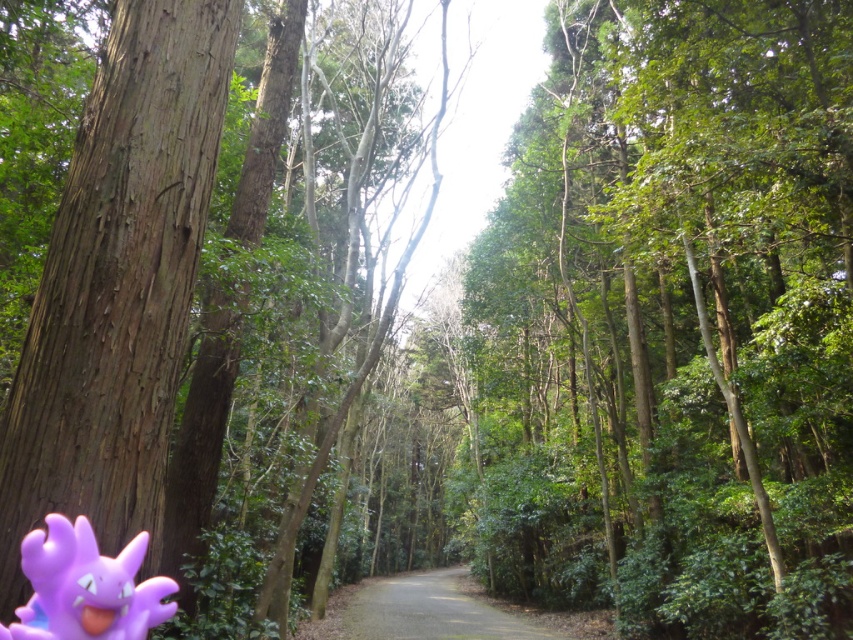
Is purple rubber toy at lower left wider than gravel road at center?

Incorrect, purple rubber toy at lower left's width does not surpass gravel road at center's.

Which is below, purple rubber toy at lower left or gravel road at center?

gravel road at center is below.

Image resolution: width=853 pixels, height=640 pixels. I want to click on purple rubber toy at lower left, so click(85, 588).